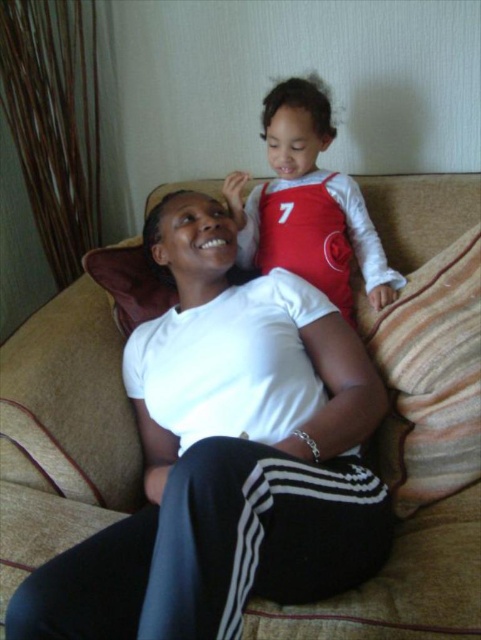
Who is positioned more to the left, beige fabric couch at center or matte red jersey at upper center?

From the viewer's perspective, matte red jersey at upper center appears more on the left side.

Does point (51, 426) come farther from viewer compared to point (313, 186)?

No, it is not.

Find the location of a particular element. The image size is (481, 640). beige fabric couch at center is located at coordinates (63, 429).

Identify the location of beige fabric couch at center. Image resolution: width=481 pixels, height=640 pixels. (63, 429).